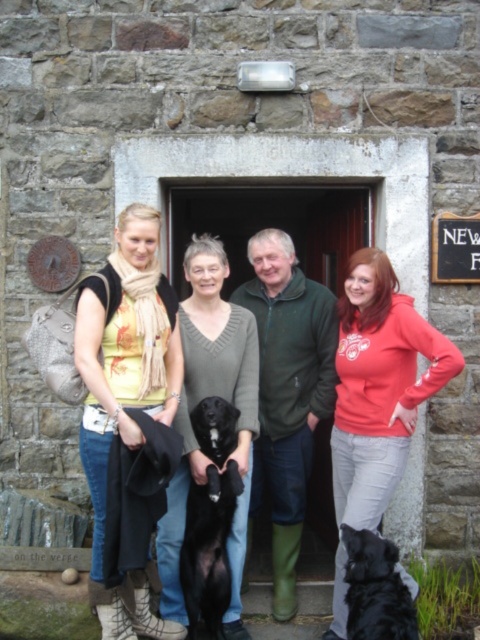
From the picture: You see two dogs in the center of the image, a matte black dog at center and a black glossy dog at center. Which one is more to the left?

The matte black dog at center is more to the left.

You are a fashion designer observing the group outside the stone building. You notice two people wearing the matte red hoodie at center and the knitted gray sweater at center. Which clothing item has a shorter length?

The matte red hoodie at center is shorter than the knitted gray sweater at center.